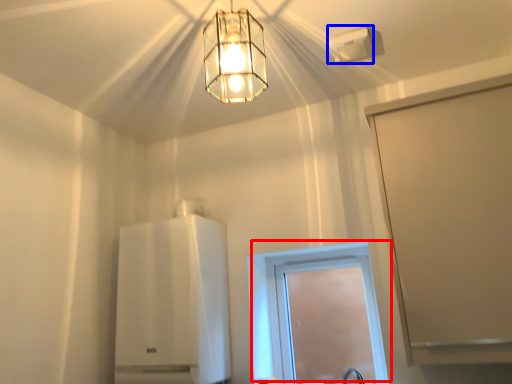
Question: Which object is closer to the camera taking this photo, window (highlighted by a red box) or lamp (highlighted by a blue box)?

Choices:
 (A) window
 (B) lamp

Answer: (B)